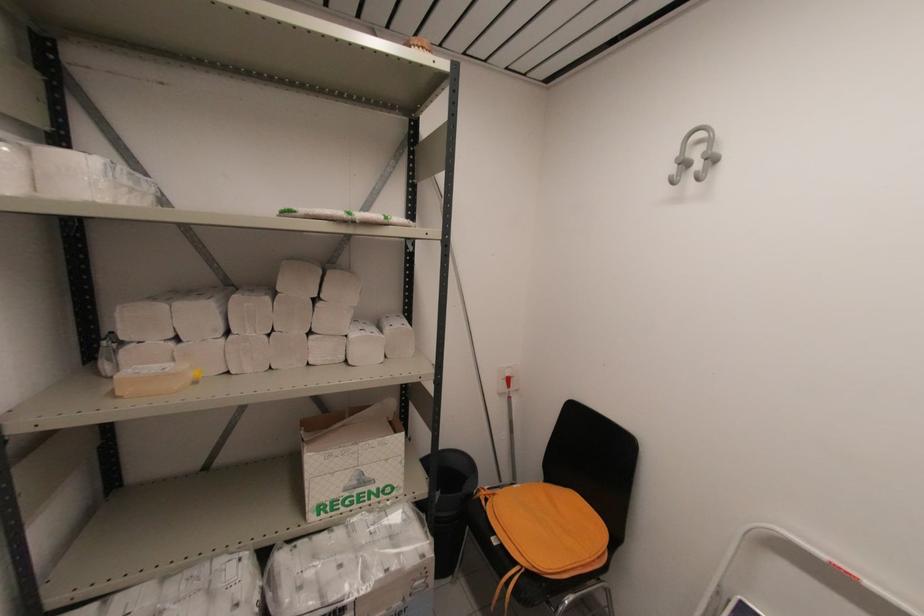
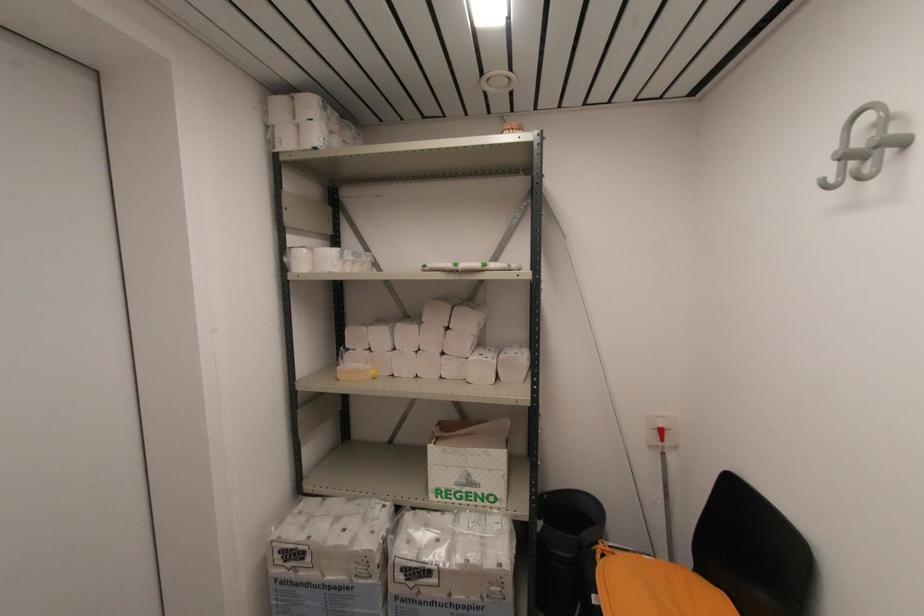
Where in the second image is the point corresponding to (x=383, y=514) from the first image?

(484, 517)